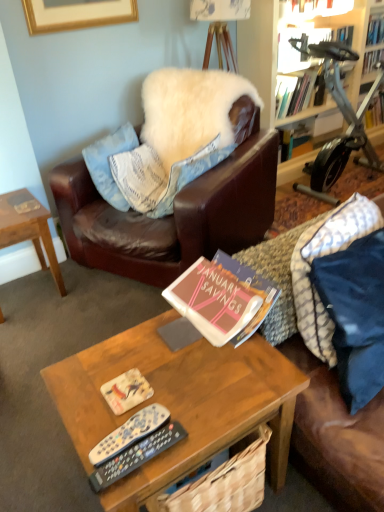
At what (x,y) coordinates should I click in order to perform the action: click on spots to the right of black plastic remote control at lower center, which is the first remote control from back to front. Please return your answer as a coordinate pair (x, y). Looking at the image, I should click on (208, 411).